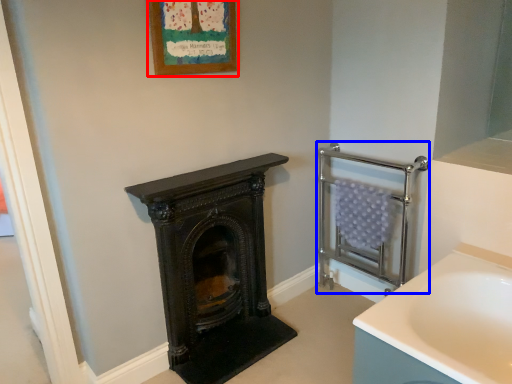
Question: Which object is further to the camera taking this photo, picture frame (highlighted by a red box) or balustrade (highlighted by a blue box)?

Choices:
 (A) picture frame
 (B) balustrade

Answer: (B)